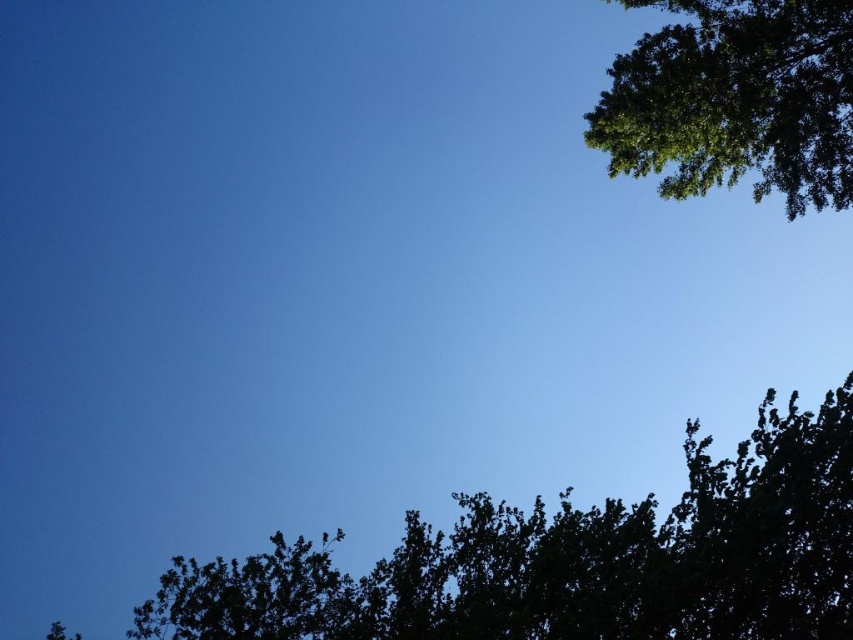
In the scene shown: You are standing at the base of the dark green leafy tree at lower center. You want to throw a ball to your friend who is standing 40 feet away from you. Can you reach your friend by throwing the ball from your current position?

The dark green leafy tree at lower center and viewer are 40.60 feet apart. Since your friend is 40 feet away, you can reach them by throwing the ball as the distance is slightly less than 40.60 feet.